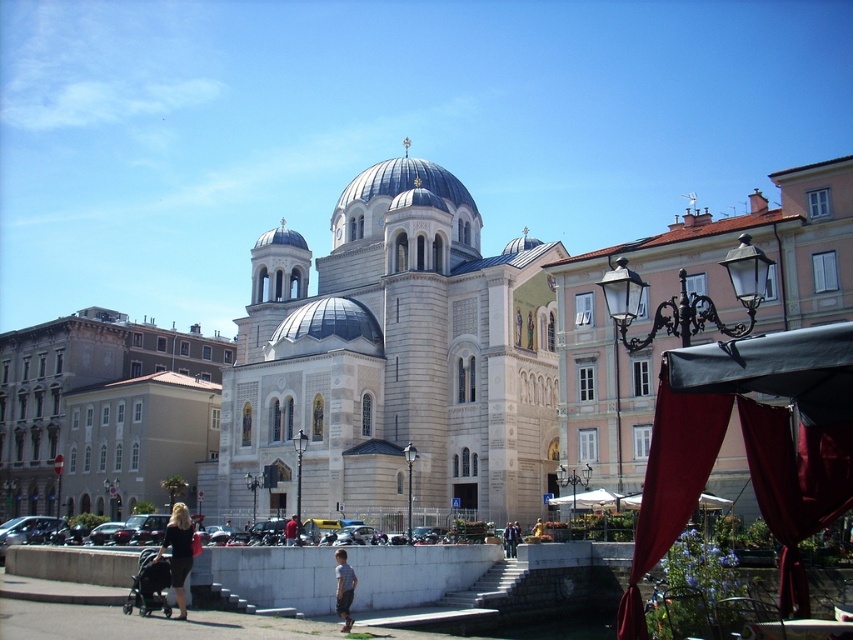
You are planning to set up a small table for a coffee stand. You have two options for placement near the grand building. One spot is under the black fabric canopy at right, and the other is near the light blue denim shorts at lower center. Which location offers more space for customers to sit comfortably?

The black fabric canopy at right offers more space for customers to sit comfortably because its width is larger than the light blue denim shorts at lower center.